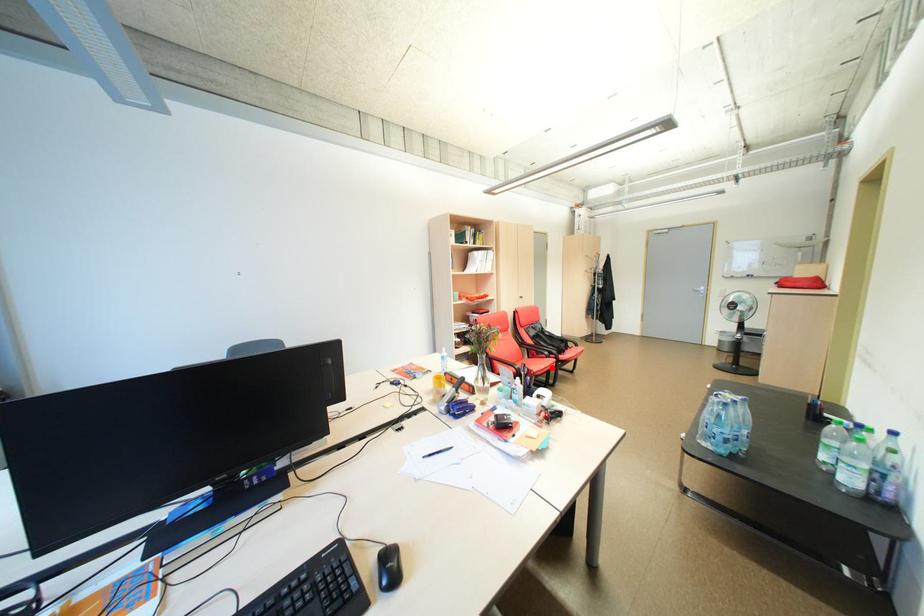
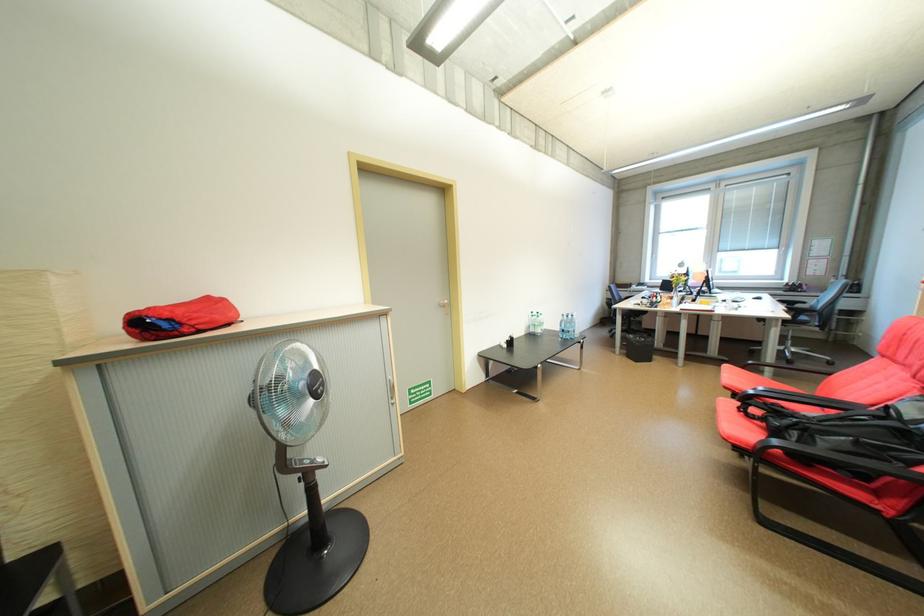
Question: I am providing you with two images of the same scene from different viewpoints. A red point is marked on the first image. Can you still see the location of the red point in image 2?

Choices:
 (A) Yes
 (B) No

Answer: (A)